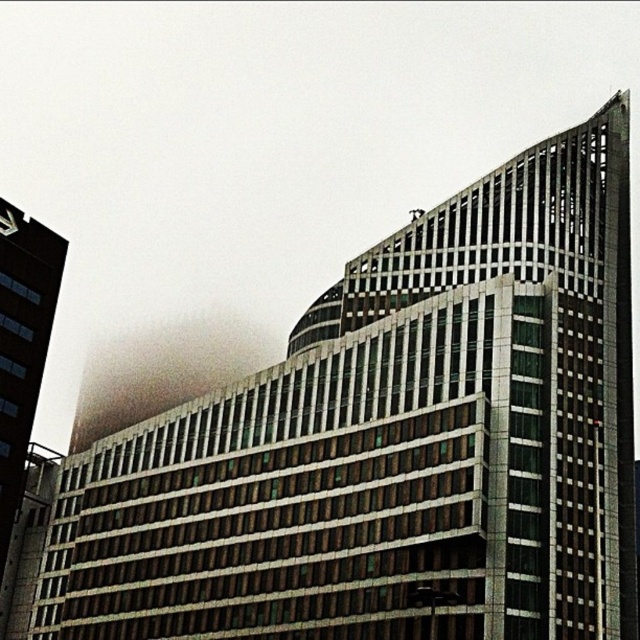
Question: Can you confirm if foggy translucent cloud at upper center is bigger than brown brick building at left?

Choices:
 (A) yes
 (B) no

Answer: (A)

Question: In this image, where is foggy translucent cloud at upper center located relative to brown brick building at left?

Choices:
 (A) below
 (B) above

Answer: (A)

Question: Among these objects, which one is farthest from the camera?

Choices:
 (A) foggy translucent cloud at upper center
 (B) brown brick building at left

Answer: (A)

Question: Can you confirm if foggy translucent cloud at upper center is positioned above brown brick building at left?

Choices:
 (A) no
 (B) yes

Answer: (A)

Question: Which point appears farthest from the camera in this image?

Choices:
 (A) (115, 404)
 (B) (8, 509)

Answer: (A)